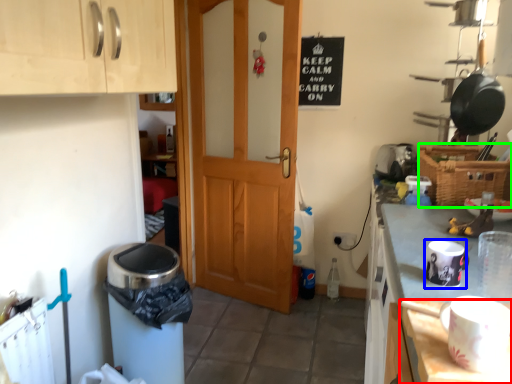
Question: Based on their relative distances, which object is nearer to table (highlighted by a red box)? Choose from appliance (highlighted by a blue box) and basket (highlighted by a green box).

Choices:
 (A) appliance
 (B) basket

Answer: (A)